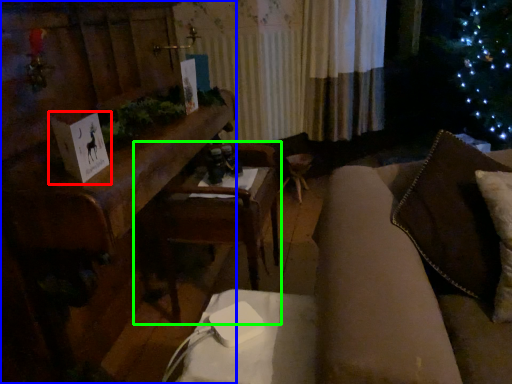
Question: Based on their relative distances, which object is farther from christmas card (highlighted by a red box)? Choose from furniture (highlighted by a blue box) and armchair (highlighted by a green box).

Choices:
 (A) furniture
 (B) armchair

Answer: (B)